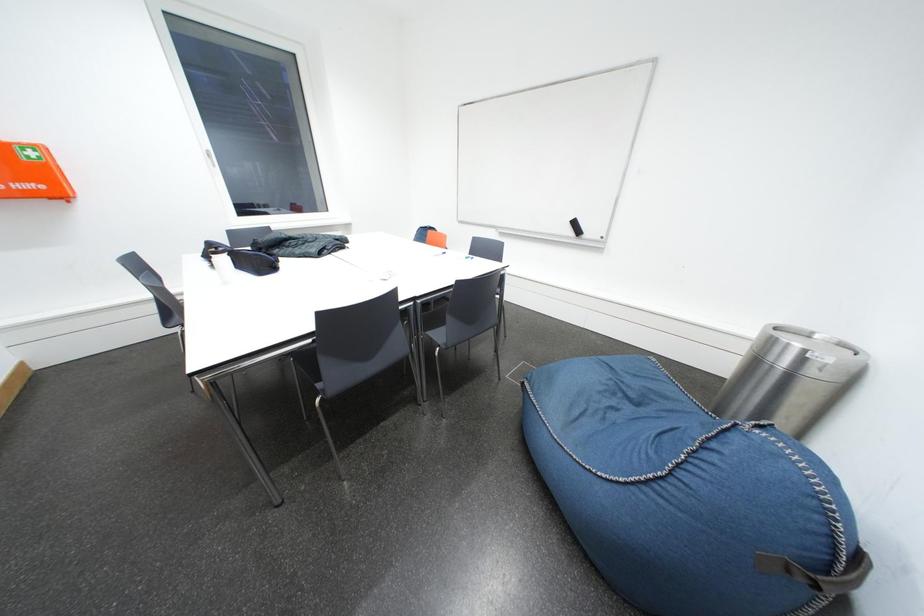
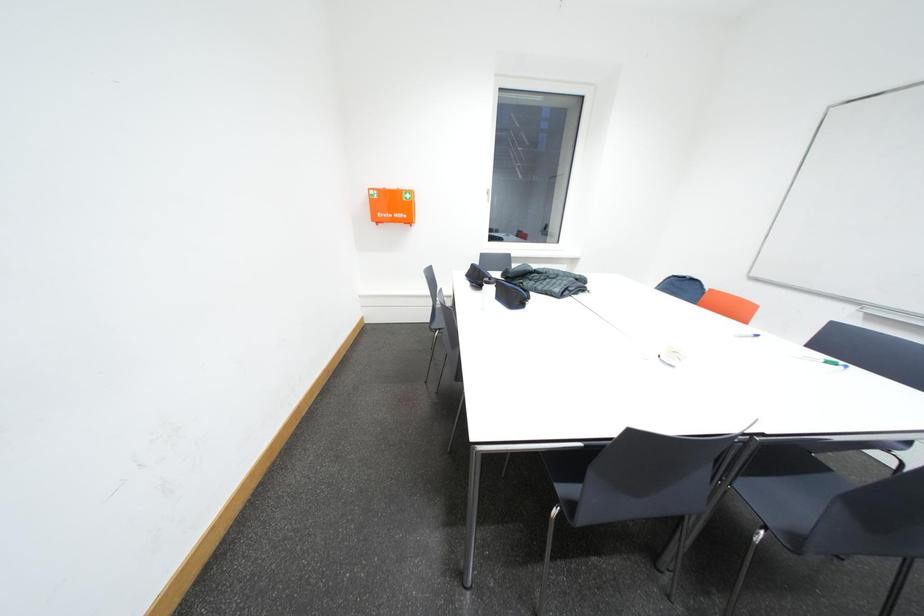
Question: Based on the continuous images, in which direction is the camera rotating? Reply with the corresponding letter.

Choices:
 (A) Left
 (B) Right
 (C) Up
 (D) Down

Answer: (A)